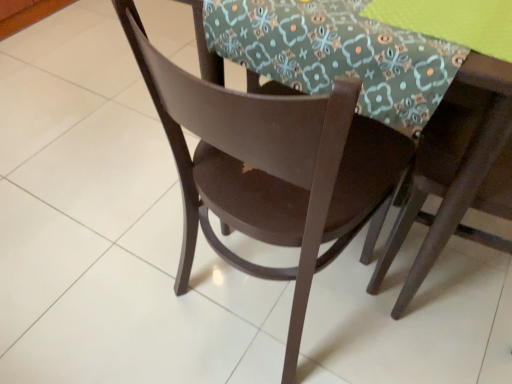
You are a GUI agent. You are given a task and a screenshot of the screen. Output one action in this format:
    pyautogui.click(x=<x>, y=<y>)
    Task: Click on the matte brown chair at center, which is the 2th chair from right to left
    This screenshot has width=512, height=384.
    Given the screenshot: What is the action you would take?
    pyautogui.click(x=272, y=169)

What do you see at coordinates (272, 169) in the screenshot? I see `matte brown chair at center, which is the 2th chair from right to left` at bounding box center [272, 169].

At what (x,y) coordinates should I click in order to perform the action: click on floral fabric at center. Please return your answer as a coordinate pair (x, y). The height and width of the screenshot is (384, 512). Looking at the image, I should click on (337, 54).

Locate an element on the screen. The width and height of the screenshot is (512, 384). matte brown table at center is located at coordinates (392, 110).

In the scene shown: Measure the distance between floral fabric at center and matte brown chair at upper right, the first chair when ordered from right to left.

floral fabric at center is 6.99 inches from matte brown chair at upper right, the first chair when ordered from right to left.

Would you say floral fabric at center is a long distance from matte brown chair at upper right, the first chair when ordered from right to left?

No.

From a real-world perspective, is floral fabric at center on matte brown chair at upper right, the first chair when ordered from right to left?

Yes, from a real-world perspective, floral fabric at center is above matte brown chair at upper right, the first chair when ordered from right to left.

What's the angular difference between floral fabric at center and matte brown chair at upper right, marked as the 2th chair in a left-to-right arrangement,'s facing directions?

9.5 degrees separate the facing orientations of floral fabric at center and matte brown chair at upper right, marked as the 2th chair in a left-to-right arrangement.

From a real-world perspective, is matte brown table at center over floral fabric at center?

Incorrect, from a real-world perspective, matte brown table at center is lower than floral fabric at center.

Looking at this image, is floral fabric at center at the back of matte brown table at center?

matte brown table at center is not turned away from floral fabric at center.

Based on their positions, is matte brown table at center located to the left or right of floral fabric at center?

Based on their positions, matte brown table at center is located to the right of floral fabric at center.

Locate an element on the screen. The width and height of the screenshot is (512, 384). the 2nd chair below the matte brown table at center (from the image's perspective) is located at coordinates (272, 169).

Is matte brown chair at center, which is the 2th chair from right to left, located outside matte brown table at center?

No, most part of matte brown chair at center, which is the 2th chair from right to left, lies within matte brown table at center.

Which object is closer to the camera taking this photo, matte brown chair at center, acting as the first chair starting from the left, or matte brown table at center?

matte brown chair at center, acting as the first chair starting from the left, is in front.

Can you confirm if matte brown chair at center, which is the 2th chair from right to left, is positioned to the right of matte brown table at center?

Incorrect, matte brown chair at center, which is the 2th chair from right to left, is not on the right side of matte brown table at center.

Can you tell me how much matte brown chair at upper right, the first chair when ordered from right to left, and matte brown table at center differ in facing direction?

matte brown chair at upper right, the first chair when ordered from right to left, and matte brown table at center are facing 8.32 degrees away from each other.

Could you tell me if matte brown chair at upper right, the first chair when ordered from right to left, is turned towards matte brown table at center?

Yes, matte brown chair at upper right, the first chair when ordered from right to left, is turned towards matte brown table at center.

The width and height of the screenshot is (512, 384). Find the location of `round table behind the matte brown chair at upper right, the first chair when ordered from right to left`. round table behind the matte brown chair at upper right, the first chair when ordered from right to left is located at coordinates (392, 110).

In the scene shown: Which object is wider, matte brown chair at upper right, the first chair when ordered from right to left, or matte brown table at center?

matte brown table at center is wider.

Which is behind, point (428, 53) or point (428, 100)?

The point (428, 100) is behind.

Is floral fabric at center inside or outside of matte brown table at center?

floral fabric at center is contained in matte brown table at center.

Is floral fabric at center taller than matte brown table at center?

No, floral fabric at center is not taller than matte brown table at center.

Is matte brown table at center at the back of floral fabric at center?

Yes, floral fabric at center is positioned with its back facing matte brown table at center.

Is matte brown table at center to the right of matte brown chair at upper right, marked as the 2th chair in a left-to-right arrangement, from the viewer's perspective?

No.

Could you tell me if matte brown table at center is facing matte brown chair at upper right, marked as the 2th chair in a left-to-right arrangement?

No, matte brown table at center is not facing towards matte brown chair at upper right, marked as the 2th chair in a left-to-right arrangement.

Locate an element on the screen. The height and width of the screenshot is (384, 512). round table lying on the left of matte brown chair at upper right, marked as the 2th chair in a left-to-right arrangement is located at coordinates (392, 110).

Is matte brown table at center positioned in front of matte brown chair at upper right, the first chair when ordered from right to left?

No, the depth of matte brown table at center is greater than that of matte brown chair at upper right, the first chair when ordered from right to left.

Is floral fabric at center oriented away from matte brown chair at center, acting as the first chair starting from the left?

floral fabric at center is not turned away from matte brown chair at center, acting as the first chair starting from the left.

From a real-world perspective, between floral fabric at center and matte brown chair at center, which is the 2th chair from right to left, who is vertically lower?

matte brown chair at center, which is the 2th chair from right to left, from a real-world perspective.

Would you say floral fabric at center is outside matte brown chair at center, which is the 2th chair from right to left?

Actually, floral fabric at center is within matte brown chair at center, which is the 2th chair from right to left.

From the image's perspective, starting from the floral fabric at center, which chair is the 1st one below? Please provide its 2D coordinates.

[(458, 170)]

Where is `tablecloth that is on the left side of matte brown table at center`? tablecloth that is on the left side of matte brown table at center is located at coordinates (337, 54).

Based on their spatial positions, is floral fabric at center or matte brown chair at center, acting as the first chair starting from the left, closer to matte brown chair at upper right, the first chair when ordered from right to left?

Among the two, floral fabric at center is located nearer to matte brown chair at upper right, the first chair when ordered from right to left.

When comparing their distances from matte brown chair at center, acting as the first chair starting from the left, does floral fabric at center or matte brown chair at upper right, the first chair when ordered from right to left, seem further?

Based on the image, matte brown chair at upper right, the first chair when ordered from right to left, appears to be further to matte brown chair at center, acting as the first chair starting from the left.

Considering their positions, is floral fabric at center positioned closer to matte brown table at center than matte brown chair at upper right, marked as the 2th chair in a left-to-right arrangement?

Based on the image, matte brown chair at upper right, marked as the 2th chair in a left-to-right arrangement, appears to be nearer to matte brown table at center.

Based on their spatial positions, is matte brown table at center or matte brown chair at upper right, marked as the 2th chair in a left-to-right arrangement, further from matte brown chair at center, which is the 2th chair from right to left?

matte brown chair at upper right, marked as the 2th chair in a left-to-right arrangement, is positioned further to the anchor matte brown chair at center, which is the 2th chair from right to left.

Estimate the real-world distances between objects in this image. Which object is further from matte brown table at center, matte brown chair at upper right, the first chair when ordered from right to left, or matte brown chair at center, which is the 2th chair from right to left?

matte brown chair at center, which is the 2th chair from right to left, is further to matte brown table at center.

When comparing their distances from floral fabric at center, does matte brown chair at upper right, the first chair when ordered from right to left, or matte brown chair at center, acting as the first chair starting from the left, seem closer?

matte brown chair at upper right, the first chair when ordered from right to left, is positioned closer to the anchor floral fabric at center.

In the scene shown: Looking at the image, which one is located closer to matte brown chair at upper right, the first chair when ordered from right to left, matte brown table at center or floral fabric at center?

matte brown table at center is positioned closer to the anchor matte brown chair at upper right, the first chair when ordered from right to left.

Which object lies nearer to the anchor point floral fabric at center, matte brown table at center or matte brown chair at center, acting as the first chair starting from the left?

matte brown table at center.

Find the location of a particular element. Image resolution: width=512 pixels, height=384 pixels. round table between matte brown chair at center, acting as the first chair starting from the left, and matte brown chair at upper right, the first chair when ordered from right to left is located at coordinates (392, 110).

Find the location of a particular element. tablecloth between matte brown chair at center, acting as the first chair starting from the left, and matte brown chair at upper right, the first chair when ordered from right to left, in the horizontal direction is located at coordinates (337, 54).

Find the location of a particular element. This screenshot has width=512, height=384. round table between floral fabric at center and matte brown chair at upper right, marked as the 2th chair in a left-to-right arrangement, in the up-down direction is located at coordinates (392, 110).

Locate an element on the screen. Image resolution: width=512 pixels, height=384 pixels. round table between floral fabric at center and matte brown chair at center, acting as the first chair starting from the left, in the vertical direction is located at coordinates (392, 110).